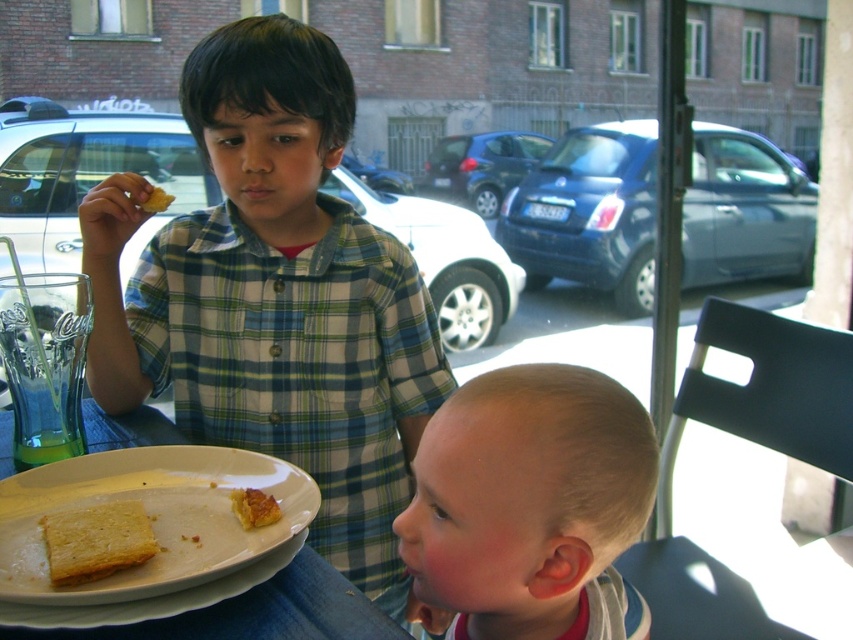
You are a waiter in a restaurant and need to place a new order on the table. The order includes a golden crispy pastry at center and a white ceramic plate at lower left. Which item should you place first to ensure there is enough space for both?

The white ceramic plate at lower left is larger in width than the golden crispy pastry at center. Therefore, you should place the white ceramic plate at lower left first to ensure there is enough space for both items on the table.

You are a photographer trying to capture the child with blonde hair at lower right and the white toasted bread at lower left in the same frame. Based on their positions, can you tell which object is closer to the camera?

The blonde hair at lower right is located below the white toasted bread at lower left, meaning it is closer to the camera than the white toasted bread at lower left.

You are a waiter in a restaurant and need to place a 4.5 inch wide dessert between the white ceramic plate at lower left and the golden crispy pastry at center. Can you fit it without moving either object?

The distance between the white ceramic plate at lower left and the golden crispy pastry at center is 4.18 inches, which is less than the dessert width of 4.5 inches. Therefore, the dessert cannot be placed between them without moving either object.